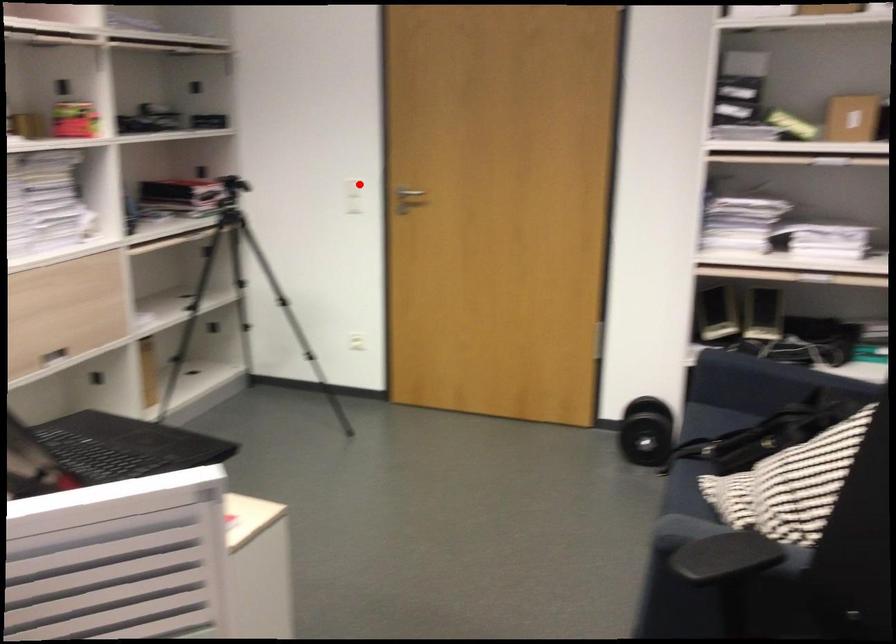
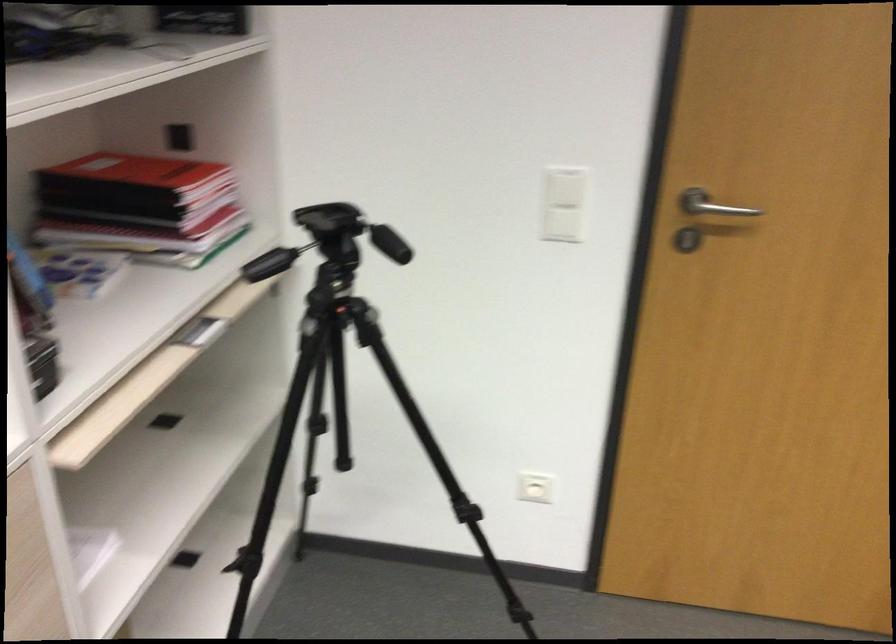
Question: I am providing you with two images of the same scene from different viewpoints. A red point is shown in image1. For the corresponding object point in image2, is it positioned nearer or farther from the camera?

Choices:
 (A) Nearer
 (B) Farther

Answer: (A)